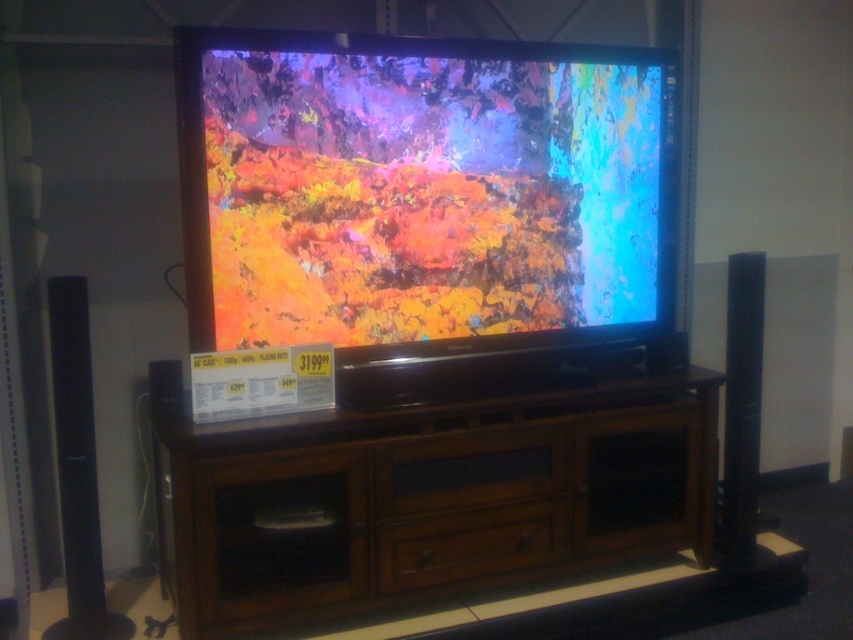
Based on the photo, you are a customer in the store and want to pick up the matte plastic television at center and the black glossy speaker at right. Which one do you need to move closer to first?

The matte plastic television at center is closer to the viewer than the black glossy speaker at right, so you should pick up the matte plastic television at center first.

You are a delivery person trying to place a new speaker that is 26 inches wide into the space between the brown wood entertainment center at center and the black glossy speaker at right. Can the speaker fit in that space?

The distance between the brown wood entertainment center at center and the black glossy speaker at right is 26.25 inches. Since the new speaker is 26 inches wide, it can fit in the space as there is enough room.

You are a customer in the electronics store looking at the matte plastic television at center and the black glossy speaker at right. Which one has a greater height?

The black glossy speaker at right is taller than the matte plastic television at center.